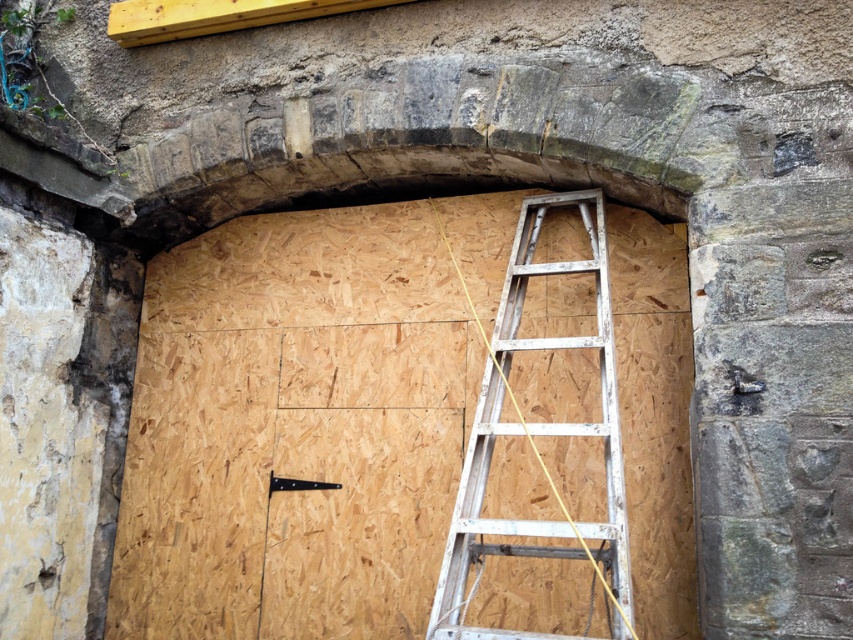
You are a construction worker standing at the base of the archway and need to access the OSB panels for repairs. You see the white aluminum ladder at center and the black metal hinge at center. Which object is positioned to the right of the other?

The white aluminum ladder at center is to the right of the black metal hinge at center.

You are a construction worker standing in front of the partially constructed stone archway. You need to access the OSB panels for repairs. The white aluminum ladder at center and the black metal hinge at center are in your way. Which object must you move first to reach the OSB panels?

The white aluminum ladder at center is positioned over the black metal hinge at center, so you must move the white aluminum ladder at center first to access the black metal hinge at center and then reach the OSB panels.

You are a construction worker needing to reach the top of the white aluminum ladder at center. However, you notice the black metal hinge at center nearby. Which object is taller, and does this affect your ability to climb the ladder safely?

The white aluminum ladder at center is taller than the black metal hinge at center. This means the ladder should provide sufficient height for you to reach the required area safely, provided it is properly secured.